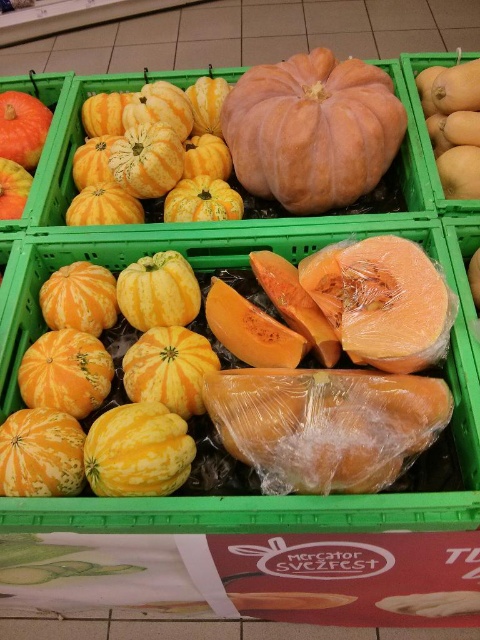
Can you confirm if translucent plastic cantaloupe at center is smaller than yellow-orange smooth pumpkin at center-left?

No.

What do you see at coordinates (296, 426) in the screenshot?
I see `translucent plastic cantaloupe at center` at bounding box center [296, 426].

Is point (408, 408) closer to camera compared to point (141, 275)?

Yes.

Where is `translucent plastic cantaloupe at center`? The height and width of the screenshot is (640, 480). translucent plastic cantaloupe at center is located at coordinates (296, 426).

Looking at this image, who is taller, orange matte pumpkin at center or yellow-orange striped pumpkin at left?

orange matte pumpkin at center

Who is positioned more to the right, orange matte pumpkin at center or yellow-orange striped pumpkin at left?

From the viewer's perspective, orange matte pumpkin at center appears more on the right side.

Is point (268, 99) farther from camera compared to point (3, 214)?

No, (268, 99) is closer to viewer.

Find the location of `orange matte pumpkin at center`. orange matte pumpkin at center is located at coordinates (312, 129).

Does orange matte pumpkin at center have a larger size compared to yellow-orange smooth pumpkin at center-left?

Yes.

Does orange matte pumpkin at center lie in front of yellow-orange smooth pumpkin at center-left?

No, orange matte pumpkin at center is behind yellow-orange smooth pumpkin at center-left.

Is point (286, 64) behind point (172, 285)?

Yes, it is behind point (172, 285).

Where is `orange matte pumpkin at center`? The height and width of the screenshot is (640, 480). orange matte pumpkin at center is located at coordinates (312, 129).